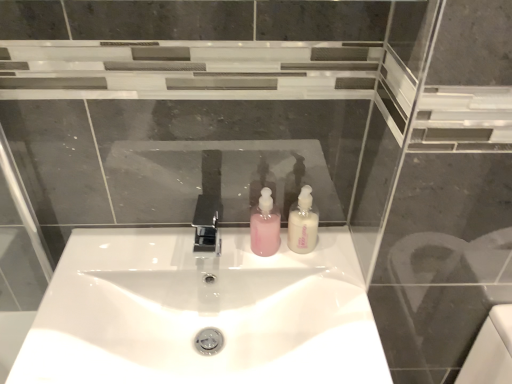
Find the location of a particular element. The width and height of the screenshot is (512, 384). vacant region to the left of white glossy soap dispenser at center, the first soap dispenser from the right is located at coordinates (224, 256).